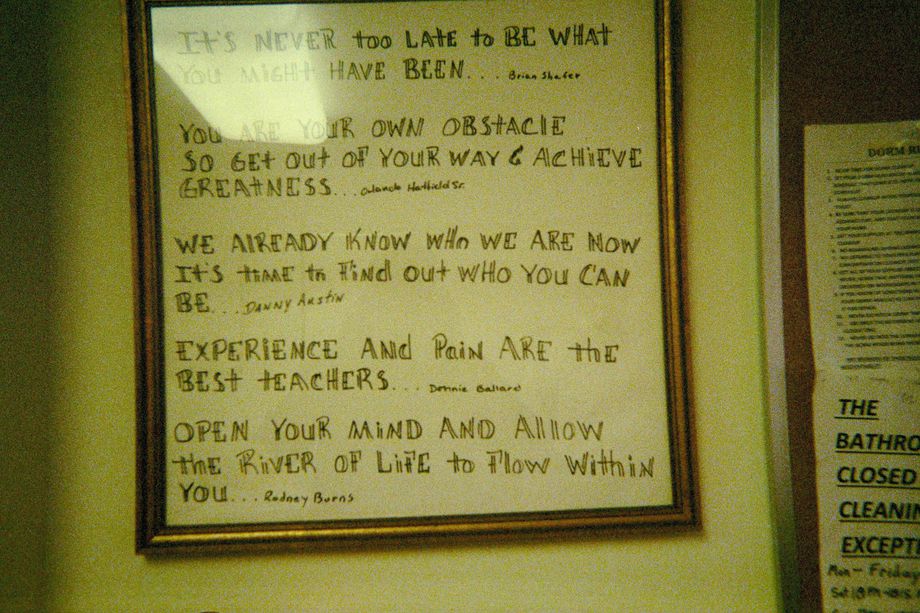
Locate an element on the screen. wall is located at coordinates (742, 474).